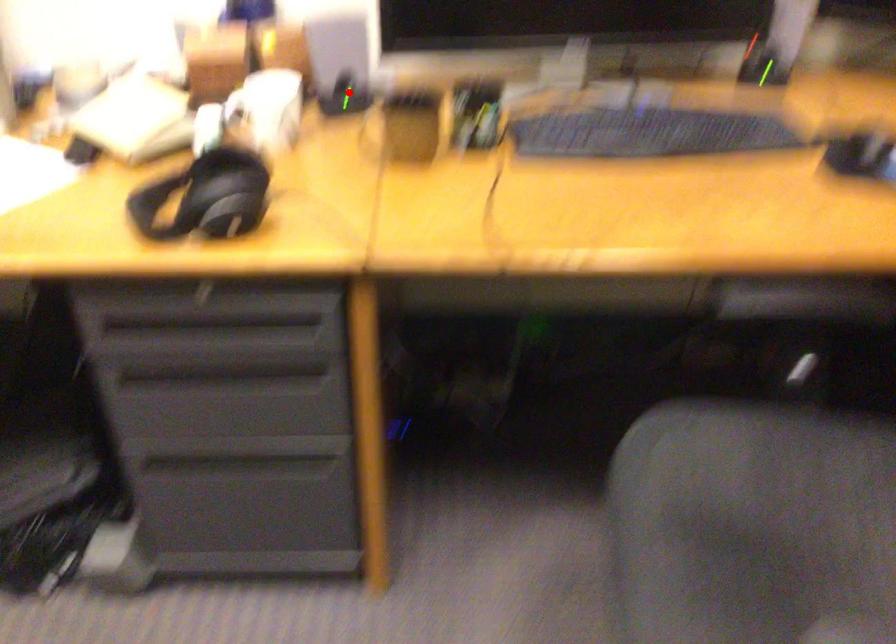
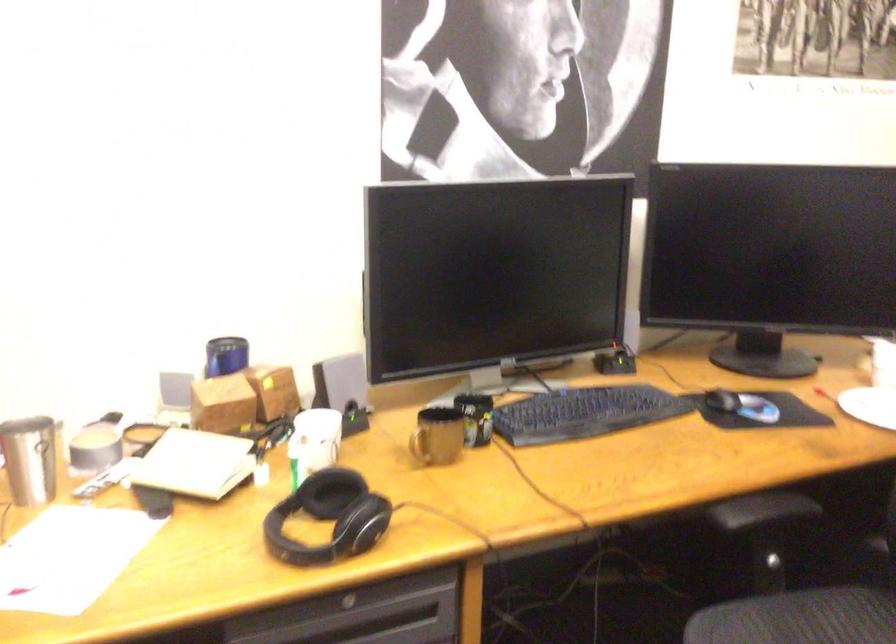
In the second image, find the point that corresponds to the highlighted location in the first image.

(352, 413)